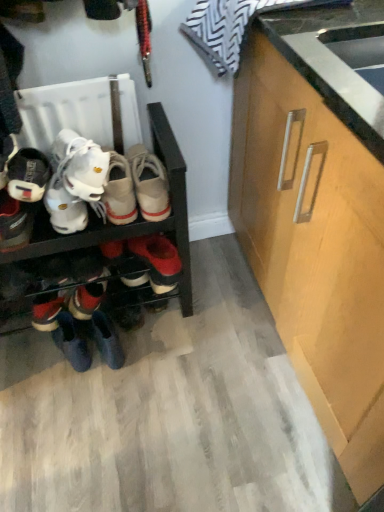
Question: From a real-world perspective, is matte black sneaker at left, which is the 2th footwear from bottom to top, positioned above or below matte black shoe at left, the first footwear positioned from the top?

Choices:
 (A) above
 (B) below

Answer: (B)

Question: Would you say matte black sneaker at left, which is the second footwear from top to bottom, is inside or outside matte black shoe at left, marked as the 3th footwear in a bottom-to-top arrangement?

Choices:
 (A) outside
 (B) inside

Answer: (A)

Question: Estimate the real-world distances between objects in this image. Which object is closer to the light wood cabinet at right?

Choices:
 (A) matte black shoe at left, the first footwear positioned from the top
 (B) leather boot at lower left, which appears as the third footwear when viewed from the top
 (C) matte black sneaker at left, which is the 2th footwear from bottom to top
 (D) wooden shoe rack at center

Answer: (D)

Question: Considering the real-world distances, which object is farthest from the leather boot at lower left, the first footwear positioned from the bottom?

Choices:
 (A) light wood cabinet at right
 (B) matte black sneaker at left, which is the 2th footwear from bottom to top
 (C) matte black shoe at left, the first footwear positioned from the top
 (D) wooden shoe rack at center

Answer: (A)